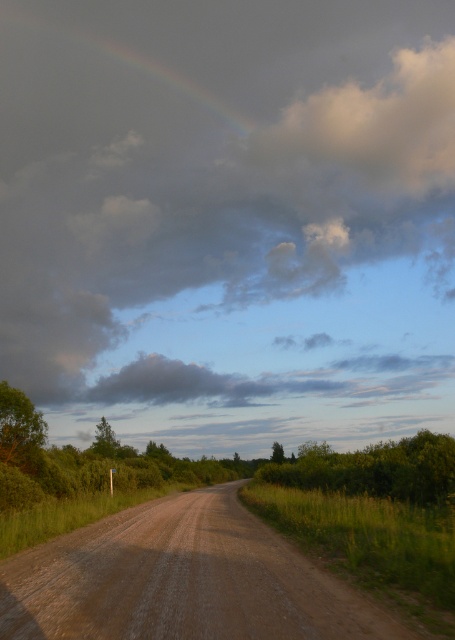
Find the location of a particular element. cloudy at upper center is located at coordinates (208, 160).

The image size is (455, 640). In order to click on cloudy at upper center in this screenshot , I will do `click(208, 160)`.

Who is lower down, cloudy at upper center or rainbow at upper center?

cloudy at upper center

Does point (71, 314) come closer to viewer compared to point (8, 22)?

Yes, point (71, 314) is in front of point (8, 22).

Find the location of a particular element. This screenshot has height=640, width=455. cloudy at upper center is located at coordinates (208, 160).

Does brown gravel road at center have a lesser height compared to rainbow at upper center?

Yes, brown gravel road at center is shorter than rainbow at upper center.

Does brown gravel road at center have a smaller size compared to rainbow at upper center?

Yes, brown gravel road at center is smaller than rainbow at upper center.

Does point (151, 611) come in front of point (177, 17)?

Yes, it is in front of point (177, 17).

Where is `brown gravel road at center`? The width and height of the screenshot is (455, 640). brown gravel road at center is located at coordinates tap(182, 580).